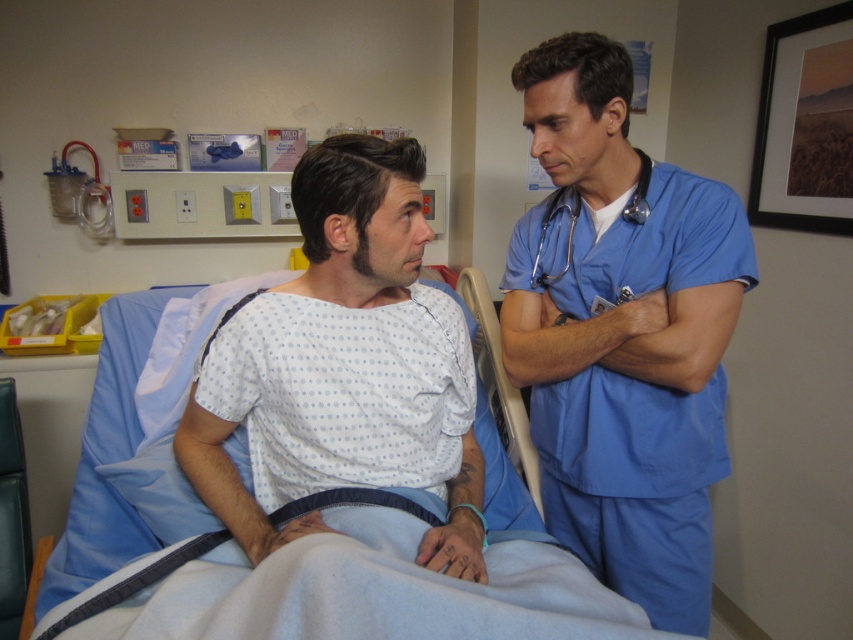
This screenshot has width=853, height=640. What do you see at coordinates (349, 356) in the screenshot?
I see `white dotted hospital gown at center` at bounding box center [349, 356].

Can you confirm if white dotted hospital gown at center is positioned to the right of metallic blue stethoscope at upper right?

No, white dotted hospital gown at center is not to the right of metallic blue stethoscope at upper right.

What do you see at coordinates (349, 356) in the screenshot? I see `white dotted hospital gown at center` at bounding box center [349, 356].

Where is `white dotted hospital gown at center`? The image size is (853, 640). white dotted hospital gown at center is located at coordinates (349, 356).

Which is above, blue scrubs at right or blue fabric hospital bed at center?

blue scrubs at right is above.

Can you confirm if blue scrubs at right is thinner than blue fabric hospital bed at center?

Yes.

Where is `blue scrubs at right`? blue scrubs at right is located at coordinates (622, 332).

At what (x,y) coordinates should I click in order to perform the action: click on blue scrubs at right. Please return your answer as a coordinate pair (x, y). Looking at the image, I should click on (622, 332).

Which of these two, blue scrubs at right or white dotted hospital gown at center, stands taller?

Standing taller between the two is blue scrubs at right.

At what (x,y) coordinates should I click in order to perform the action: click on blue scrubs at right. Please return your answer as a coordinate pair (x, y). The height and width of the screenshot is (640, 853). Looking at the image, I should click on (622, 332).

Image resolution: width=853 pixels, height=640 pixels. What do you see at coordinates (622, 332) in the screenshot?
I see `blue scrubs at right` at bounding box center [622, 332].

Where is `blue scrubs at right`? Image resolution: width=853 pixels, height=640 pixels. blue scrubs at right is located at coordinates (622, 332).